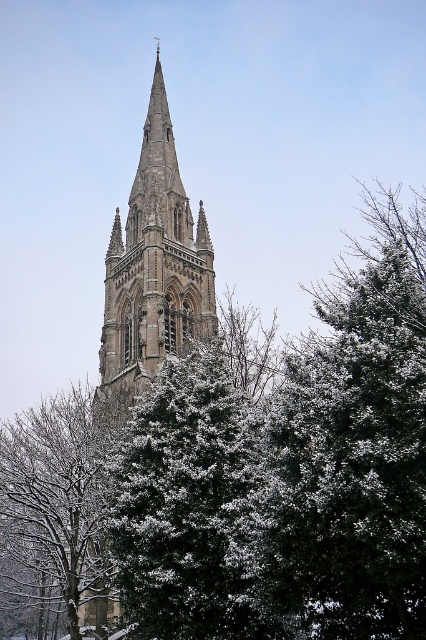
Question: Which point is closer to the camera taking this photo?

Choices:
 (A) (89, 458)
 (B) (222, 429)
 (C) (175, 164)

Answer: (B)

Question: Which of the following is the farthest from the observer?

Choices:
 (A) (233, 566)
 (B) (94, 564)

Answer: (B)

Question: Considering the relative positions of green textured pine tree at center and snow-covered evergreen tree at center in the image provided, where is green textured pine tree at center located with respect to snow-covered evergreen tree at center?

Choices:
 (A) below
 (B) above

Answer: (B)

Question: Which point is closer to the camera?

Choices:
 (A) (109, 524)
 (B) (112, 278)
 (C) (8, 515)

Answer: (A)

Question: Can you confirm if snow-covered evergreen tree at center is wider than stone gothic tower at center?

Choices:
 (A) yes
 (B) no

Answer: (A)

Question: Is green textured pine tree at center positioned at the back of stone gothic tower at center?

Choices:
 (A) yes
 (B) no

Answer: (B)